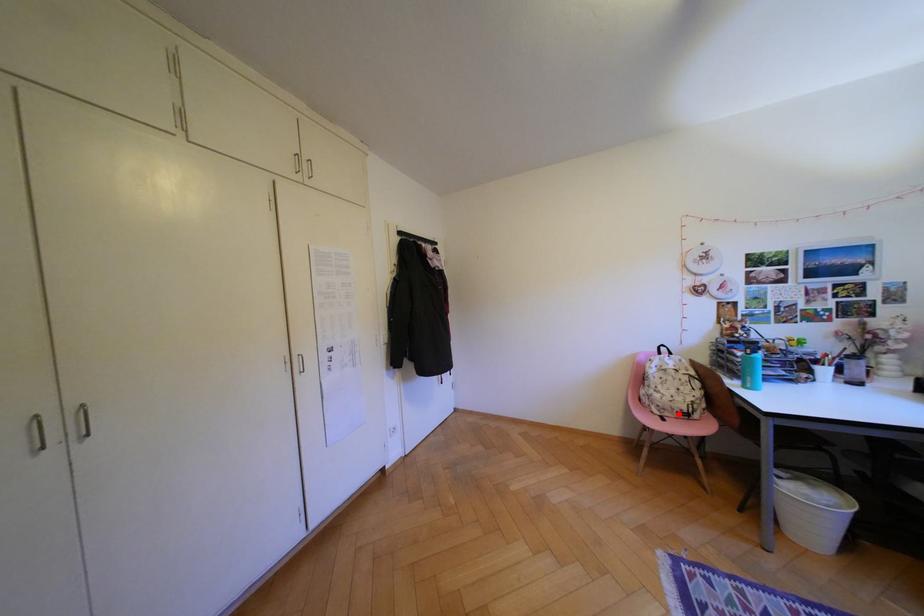
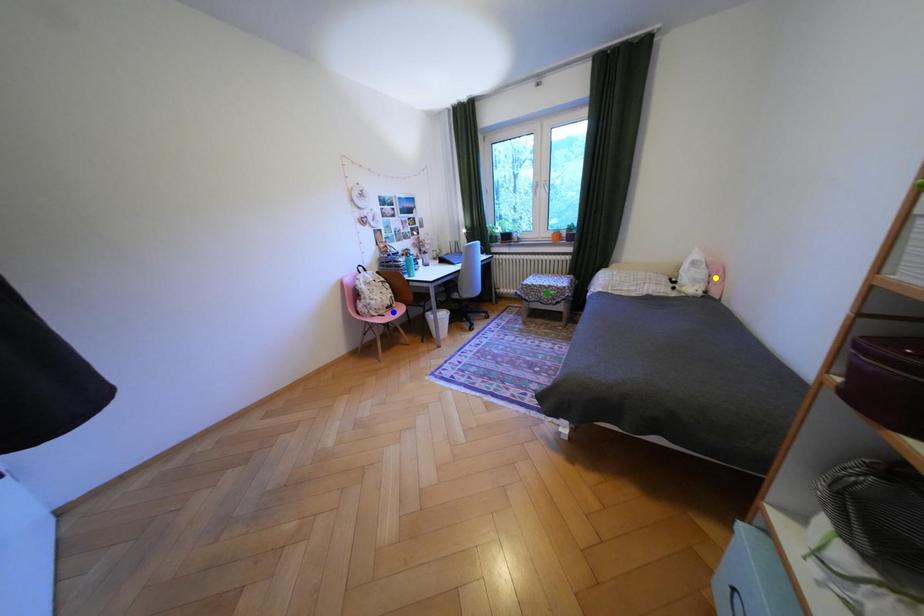
Question: I am providing you with two images of the same scene from different viewpoints. A red point is marked on the first image. You are given multiple points on the second image. In image 2, which mark is for the same physical point as the one in image 1?

Choices:
 (A) yellow point
 (B) blue point
 (C) green point

Answer: (B)